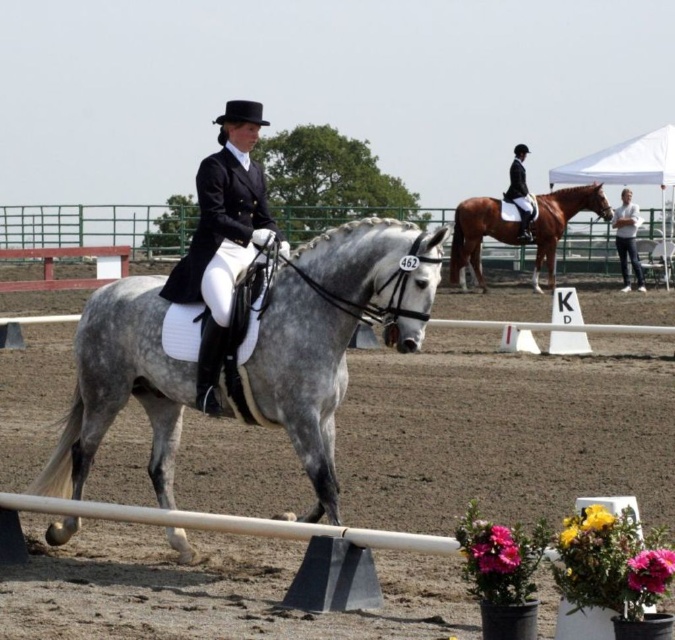
Question: Is white jeans at right bigger than black leather jacket at center?

Choices:
 (A) no
 (B) yes

Answer: (B)

Question: Which point is farther to the camera?

Choices:
 (A) gray glossy horse at center
 (B) black satin riding jacket at center

Answer: (A)

Question: Does black satin riding jacket at center appear on the left side of black leather jacket at center?

Choices:
 (A) yes
 (B) no

Answer: (A)

Question: Which object is farther from the camera taking this photo?

Choices:
 (A) black leather jacket at center
 (B) black satin riding jacket at center
 (C) shiny brown horse at upper right

Answer: (A)

Question: Does gray glossy horse at center appear over black leather jacket at center?

Choices:
 (A) yes
 (B) no

Answer: (B)

Question: Which object appears farthest from the camera in this image?

Choices:
 (A) shiny brown horse at upper right
 (B) white jeans at right

Answer: (B)